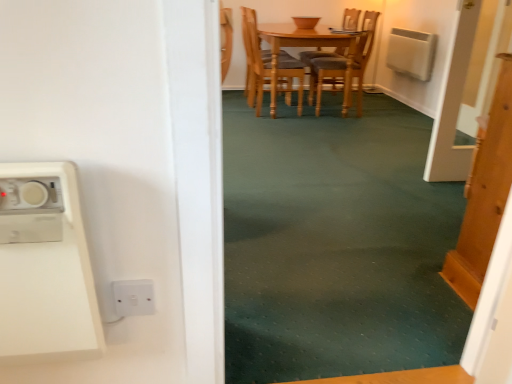
Question: From the image's perspective, does white plastic microwave at left appear higher than green carpet at center?

Choices:
 (A) yes
 (B) no

Answer: (B)

Question: Considering the relative sizes of white plastic microwave at left and green carpet at center in the image provided, is white plastic microwave at left shorter than green carpet at center?

Choices:
 (A) yes
 (B) no

Answer: (B)

Question: From a real-world perspective, is white plastic microwave at left beneath green carpet at center?

Choices:
 (A) yes
 (B) no

Answer: (B)

Question: Is white plastic microwave at left thinner than green carpet at center?

Choices:
 (A) no
 (B) yes

Answer: (B)

Question: From a real-world perspective, is white plastic microwave at left over green carpet at center?

Choices:
 (A) yes
 (B) no

Answer: (A)

Question: Considering the positions of point (121, 304) and point (87, 337), is point (121, 304) closer or farther from the camera than point (87, 337)?

Choices:
 (A) closer
 (B) farther

Answer: (B)

Question: From a real-world perspective, is white plastic switch at lower center above or below white plastic microwave at left?

Choices:
 (A) below
 (B) above

Answer: (A)

Question: Considering the positions of white plastic switch at lower center and white plastic microwave at left in the image, is white plastic switch at lower center wider or thinner than white plastic microwave at left?

Choices:
 (A) thin
 (B) wide

Answer: (A)

Question: In the image, is white plastic switch at lower center on the left side or the right side of white plastic microwave at left?

Choices:
 (A) left
 (B) right

Answer: (B)

Question: Looking at the image, does green carpet at center seem bigger or smaller compared to wooden door at right?

Choices:
 (A) big
 (B) small

Answer: (A)

Question: From a real-world perspective, is green carpet at center above or below wooden door at right?

Choices:
 (A) above
 (B) below

Answer: (B)

Question: From the image's perspective, is green carpet at center located above or below wooden door at right?

Choices:
 (A) below
 (B) above

Answer: (B)

Question: Considering the positions of green carpet at center and wooden door at right in the image, is green carpet at center wider or thinner than wooden door at right?

Choices:
 (A) thin
 (B) wide

Answer: (B)

Question: From a real-world perspective, is light brown wooden chair at center physically located above or below wooden door at right?

Choices:
 (A) below
 (B) above

Answer: (B)

Question: From the image's perspective, is light brown wooden chair at center located above or below wooden door at right?

Choices:
 (A) below
 (B) above

Answer: (B)